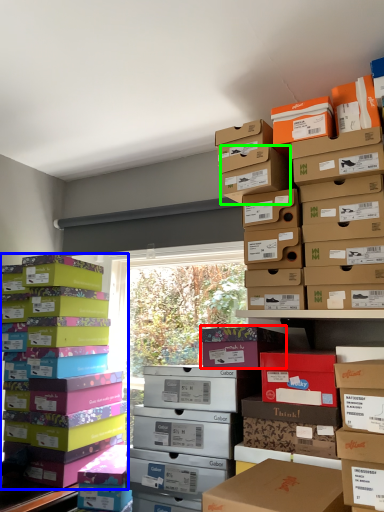
Question: Considering the real-world distances, which object is farthest from cardboard box (highlighted by a red box)? box (highlighted by a blue box) or storage box (highlighted by a green box)?

Choices:
 (A) box
 (B) storage box

Answer: (A)